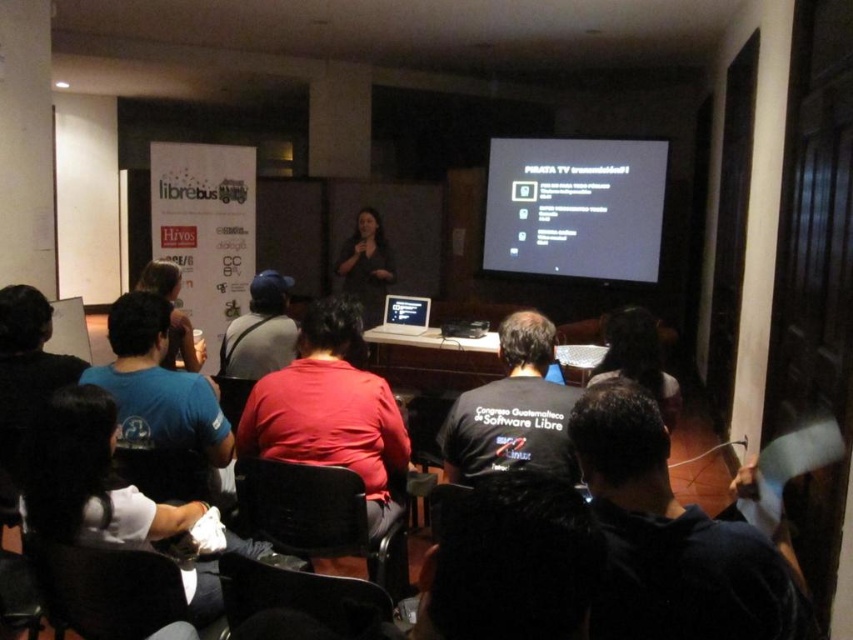
Question: Considering the real-world distances, which object is closest to the black fabric shirt at lower right?

Choices:
 (A) matte black shirt at center
 (B) black fabric hair at center
 (C) dark gray shirt at center
 (D) dark brown hair at lower center

Answer: (B)

Question: Which object is positioned farthest from the black fabric hair at center?

Choices:
 (A) white plastic laptop at center
 (B) red matte shirt at center
 (C) matte black screen at upper center

Answer: (C)

Question: Does black fabric shirt at lower right appear under black fabric hair at center?

Choices:
 (A) no
 (B) yes

Answer: (B)

Question: Does dark brown hair at lower center have a larger size compared to matte black shirt at center?

Choices:
 (A) no
 (B) yes

Answer: (A)

Question: Which object appears closest to the camera in this image?

Choices:
 (A) black fabric shirt at center
 (B) matte black shirt at center
 (C) matte black screen at upper center
 (D) white fabric shirt at lower center

Answer: (D)

Question: Can you confirm if matte black screen at upper center is positioned to the left of blue fabric shirt at center?

Choices:
 (A) no
 (B) yes

Answer: (A)